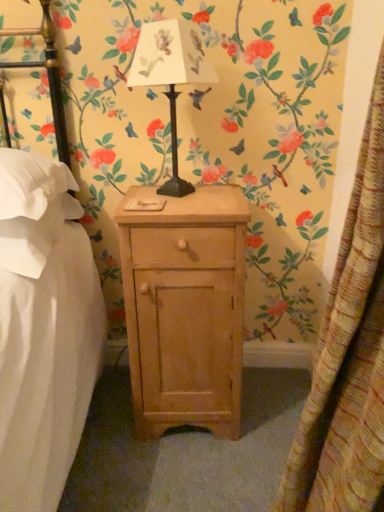
Question: Is metallic black table lamp at center to the left of light wood nightstand at center from the viewer's perspective?

Choices:
 (A) no
 (B) yes

Answer: (B)

Question: Is metallic black table lamp at center positioned behind light wood nightstand at center?

Choices:
 (A) no
 (B) yes

Answer: (A)

Question: Does metallic black table lamp at center have a greater width compared to light wood nightstand at center?

Choices:
 (A) yes
 (B) no

Answer: (B)

Question: Is light wood nightstand at center at the back of metallic black table lamp at center?

Choices:
 (A) no
 (B) yes

Answer: (A)

Question: Is metallic black table lamp at center not near light wood nightstand at center?

Choices:
 (A) yes
 (B) no

Answer: (B)

Question: Is metallic black table lamp at center bigger than light wood nightstand at center?

Choices:
 (A) yes
 (B) no

Answer: (B)

Question: Is metallic black table lamp at center placed right next to white fabric pillow at left, acting as the 1th pillow starting from the bottom?

Choices:
 (A) yes
 (B) no

Answer: (B)

Question: From the image's perspective, is metallic black table lamp at center under white fabric pillow at left, the 2th pillow in the top-to-bottom sequence?

Choices:
 (A) no
 (B) yes

Answer: (A)

Question: Is metallic black table lamp at center taller than white fabric pillow at left, acting as the 1th pillow starting from the bottom?

Choices:
 (A) yes
 (B) no

Answer: (A)

Question: Is metallic black table lamp at center further to the viewer compared to white fabric pillow at left, acting as the 1th pillow starting from the bottom?

Choices:
 (A) yes
 (B) no

Answer: (B)

Question: Could you tell me if metallic black table lamp at center is turned towards white fabric pillow at left, acting as the 1th pillow starting from the bottom?

Choices:
 (A) no
 (B) yes

Answer: (A)

Question: Is metallic black table lamp at center completely or partially outside of white fabric pillow at left, the 2th pillow in the top-to-bottom sequence?

Choices:
 (A) no
 (B) yes

Answer: (B)

Question: From the image's perspective, is textured yellow curtain at right located beneath white fabric pillow at left, acting as the 1th pillow starting from the bottom?

Choices:
 (A) no
 (B) yes

Answer: (B)